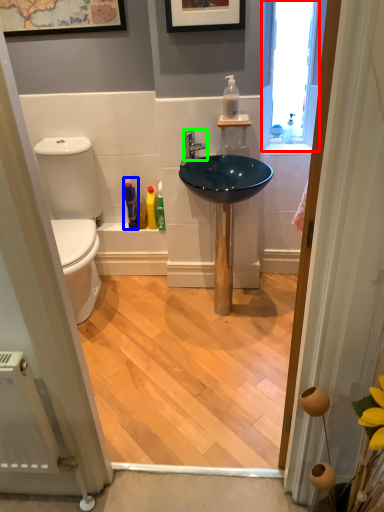
Question: Which object is the closest to the window (highlighted by a red box)? Choose among these: toiletry (highlighted by a blue box) or tap (highlighted by a green box).

Choices:
 (A) toiletry
 (B) tap

Answer: (B)